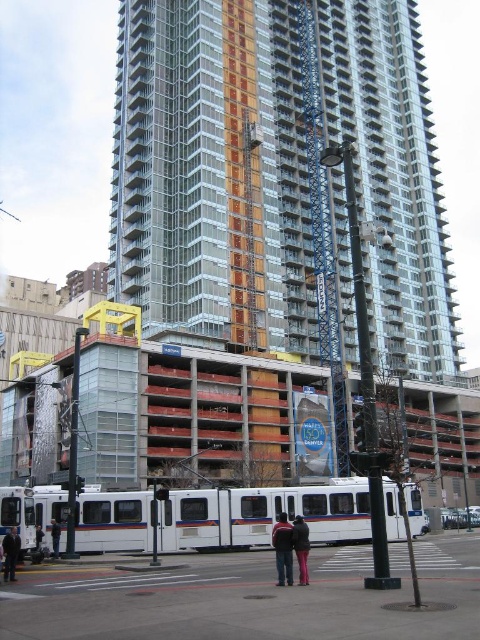
You are standing at the construction site and want to know which of the two points, point [191,136] or point [12,563], is closer to you. Which one is closer?

Point [191,136] is closer to you because it is further to the viewer than point [12,563].

You are standing at the origin point of the coordinate system. Which direction should you move to reach the clear glass building at center?

The clear glass building at center is located at coordinate point 0.267 on the x axis and 0.442 on the y axis. Since you are at the origin, you should move northeast to reach it.

You are a pedestrian standing near the tram and want to greet the person wearing the matte black jacket at center and the person wearing the white fabric jacket at lower left. Which jacket is closer to the tram?

The white fabric jacket at lower left is closer to the tram because the matte black jacket at center is to the right of it, meaning the white fabric jacket at lower left is positioned between the tram and the matte black jacket at center.